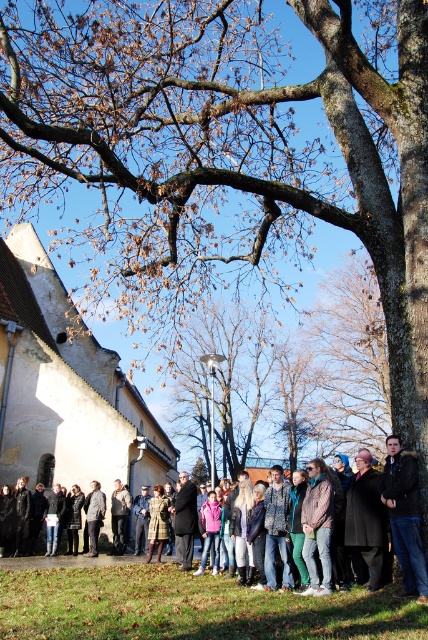
Which of these two, dark gray wool coat at lower right or dark brown leather jacket at center, stands taller?

Standing taller between the two is dark brown leather jacket at center.

Is point (353, 566) in front of point (29, 566)?

Yes, point (353, 566) is in front of point (29, 566).

You are a GUI agent. You are given a task and a screenshot of the screen. Output one action in this format:
    pyautogui.click(x=<x>, y=<y>)
    Task: Click on the dark gray wool coat at lower right
    
    Given the screenshot: What is the action you would take?
    pyautogui.click(x=365, y=522)

Does point (409, 532) lie behind point (124, 508)?

No, it is in front of (124, 508).

Between point (394, 492) and point (124, 509), which one is positioned in front?

Positioned in front is point (394, 492).

Is point (407, 483) less distant than point (118, 550)?

Yes, point (407, 483) is in front of point (118, 550).

At what (x,y) coordinates should I click in order to perform the action: click on dark brown leather jacket at lower right. Please return your answer as a coordinate pair (x, y). This screenshot has width=428, height=640. Looking at the image, I should click on (404, 516).

Between brown rough tree at center and dark gray jacket at center, which one has less height?

With less height is dark gray jacket at center.

Who is positioned more to the left, brown rough tree at center or dark gray jacket at center?

dark gray jacket at center is more to the left.

Is point (174, 378) behind point (115, 497)?

Yes, it is.

You are a GUI agent. You are given a task and a screenshot of the screen. Output one action in this format:
    pyautogui.click(x=<x>, y=<y>)
    Task: Click on the brown rough tree at center
    This screenshot has height=640, width=428.
    Given the screenshot: What is the action you would take?
    pyautogui.click(x=222, y=380)